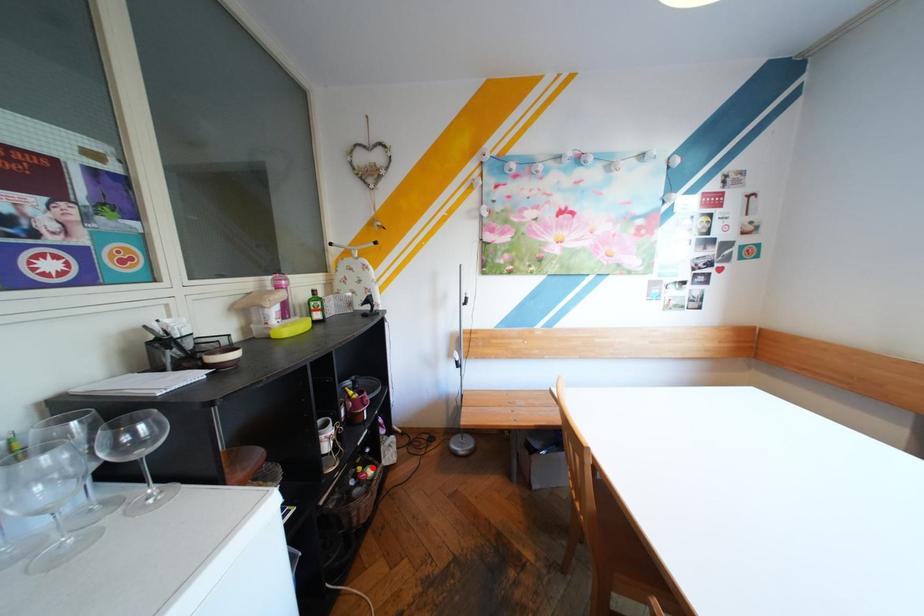
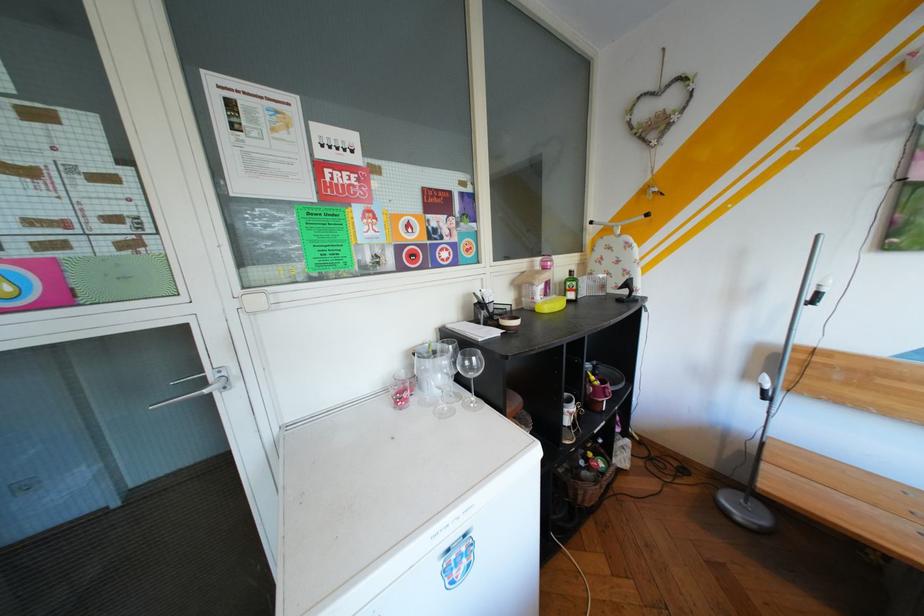
Locate, in the second image, the point that corresponds to the highlighted location in the first image.

(603, 454)